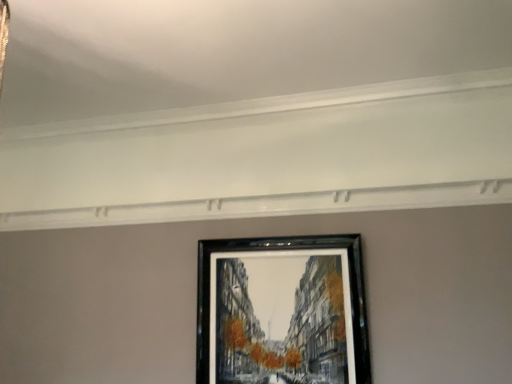
In order to face black glossy picture frame at center, should I rotate leftwards or rightwards?

You should look right and rotate roughly 3.014 degrees.

This screenshot has height=384, width=512. Describe the element at coordinates (282, 311) in the screenshot. I see `black glossy picture frame at center` at that location.

I want to click on black glossy picture frame at center, so click(282, 311).

In order to click on black glossy picture frame at center in this screenshot , I will do `click(282, 311)`.